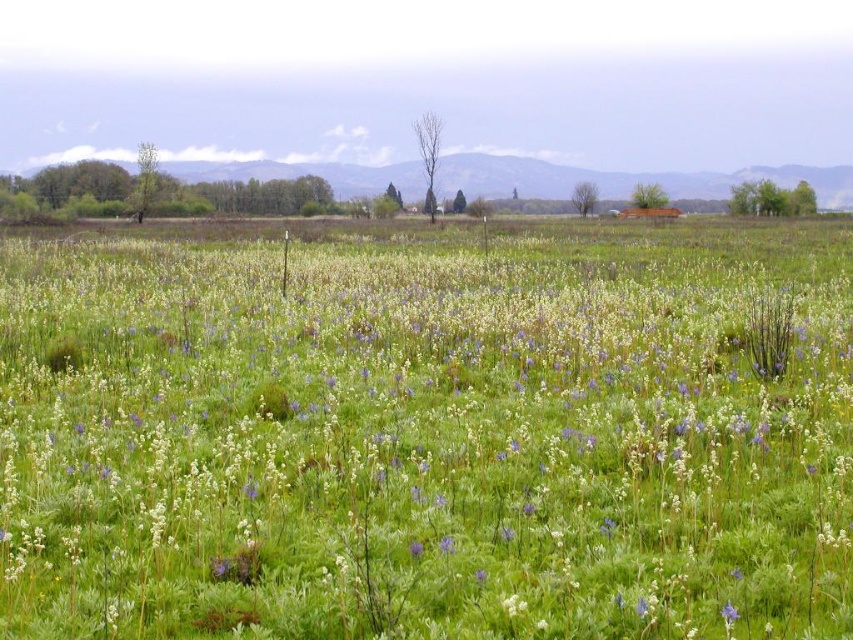
Between white fluffy plant at center and purple matte flower at lower right, which one has more height?

white fluffy plant at center

Who is more distant from viewer, (187, 291) or (730, 614)?

Positioned behind is point (187, 291).

This screenshot has height=640, width=853. I want to click on white fluffy plant at center, so click(x=410, y=451).